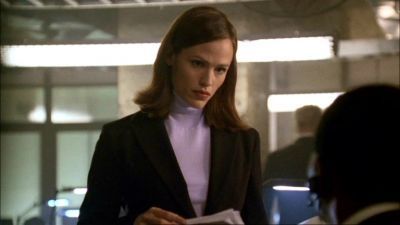
This screenshot has height=225, width=400. In order to click on lights in this screenshot , I will do `click(135, 52)`, `click(301, 99)`.